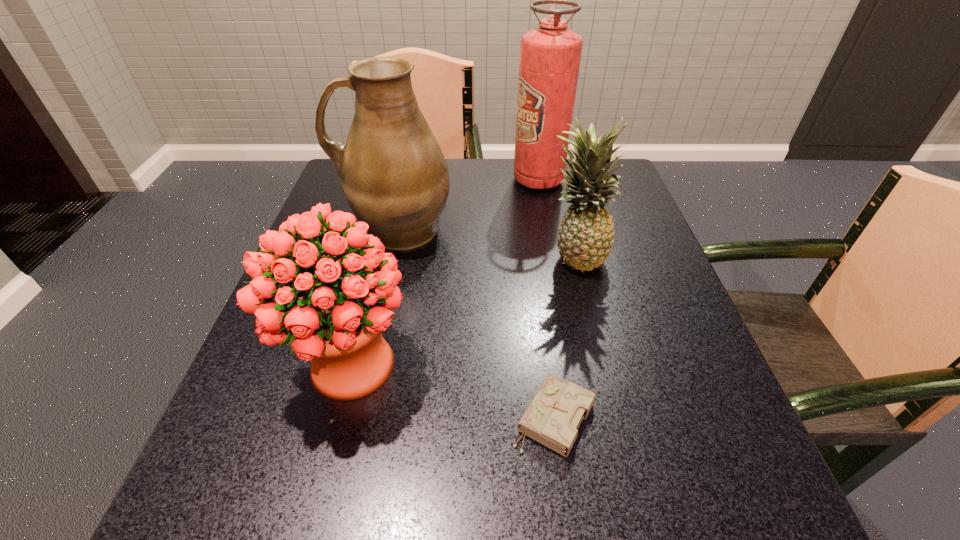
Image resolution: width=960 pixels, height=540 pixels. In order to click on fire extinguisher in this screenshot , I will do `click(550, 55)`.

At what (x,y) coordinates should I click in order to perform the action: click on pitcher. Please return your answer as a coordinate pair (x, y). This screenshot has height=540, width=960. Looking at the image, I should click on (395, 178).

Where is `pineapple`? This screenshot has width=960, height=540. pineapple is located at coordinates (585, 236).

Find the location of `bouquet`. bouquet is located at coordinates (337, 323).

The height and width of the screenshot is (540, 960). Identify the location of diary. (552, 418).

Locate an element on the screen. The height and width of the screenshot is (540, 960). free space located 0.160m on the label side of the farthest object is located at coordinates (452, 180).

You are a GUI agent. You are given a task and a screenshot of the screen. Output one action in this format:
    pyautogui.click(x=<x>, y=<y>)
    Task: Click on the free point located 0.190m on the label side of the farthest object
    The width and height of the screenshot is (960, 540).
    Given the screenshot: What is the action you would take?
    pyautogui.click(x=441, y=180)

This screenshot has height=540, width=960. In order to click on vacant space located on the label side of the farthest object in this screenshot , I will do `click(406, 180)`.

Where is `vacant space located 0.230m on the left of the pineapple`? Image resolution: width=960 pixels, height=540 pixels. vacant space located 0.230m on the left of the pineapple is located at coordinates (432, 255).

Locate an element on the screen. free location located on the right of the bouquet is located at coordinates (589, 365).